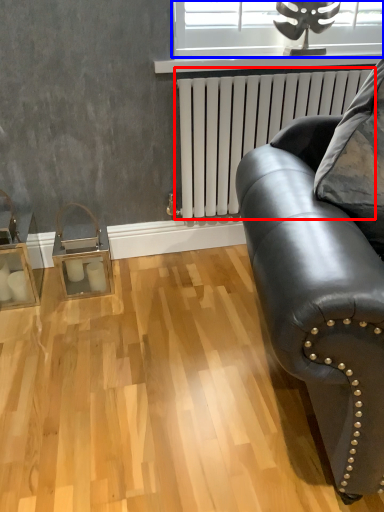
Question: Which object is further to the camera taking this photo, radiator (highlighted by a red box) or window (highlighted by a blue box)?

Choices:
 (A) radiator
 (B) window

Answer: (B)